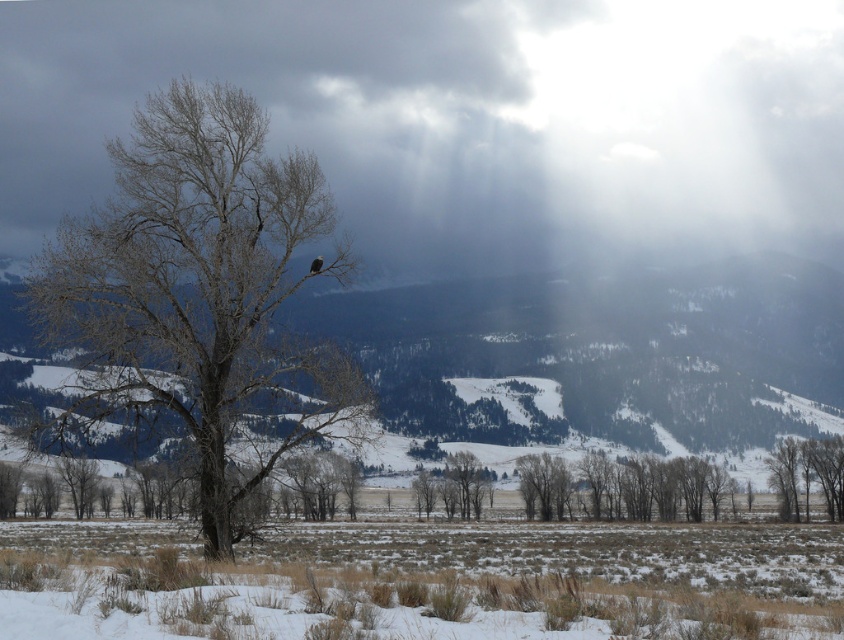
Question: Which object is positioned closest to the smooth bark tree at center?

Choices:
 (A) smooth brown tree at center
 (B) gray bark tree at center

Answer: (A)

Question: Based on their relative distances, which object is nearer to the smooth brown tree at center?

Choices:
 (A) smooth brown tree at lower right
 (B) cloudy gray sky at upper center

Answer: (A)

Question: Can you confirm if cloudy gray sky at upper center is positioned to the left of smooth brown tree at center?

Choices:
 (A) no
 (B) yes

Answer: (B)

Question: Does smooth brown tree at center appear over smooth bark tree at center?

Choices:
 (A) yes
 (B) no

Answer: (B)

Question: Estimate the real-world distances between objects in this image. Which object is closer to the smooth bark tree at center?

Choices:
 (A) smooth brown tree at center
 (B) gray bark tree at center
 (C) smooth brown tree at lower right

Answer: (A)

Question: Is cloudy gray sky at upper center to the right of gray bark tree at center from the viewer's perspective?

Choices:
 (A) no
 (B) yes

Answer: (B)